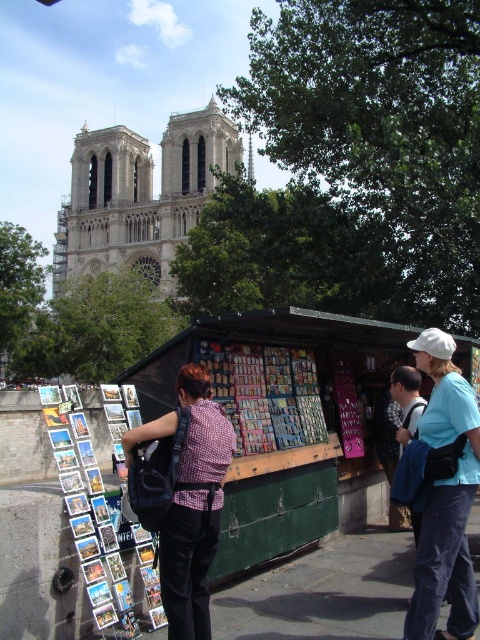
You are a tourist standing in front of the stone gothic cathedral at upper left. You want to take a photo of the cathedral with your smartphone. Considering the cathedral is 329.52 feet away from you, will your smartphone camera be able to capture the entire cathedral in one shot?

The stone gothic cathedral at upper left is 329.52 feet away from the camera. Since smartphones typically have a wide enough angle to capture large structures at that distance, it is likely possible to take a photo that includes the entire cathedral in one shot.

You are a tourist standing in front of the stone gothic cathedral at upper left and the plaid shirt at center. Which object appears larger in the image?

The stone gothic cathedral at upper left appears larger because it is taller than the plaid shirt at center.

You are a tourist standing in front of the stone gothic cathedral at upper left and the plaid shirt at center. Which object is closer to you?

The stone gothic cathedral at upper left is closer to you because it is further to the viewer than the plaid shirt at center.